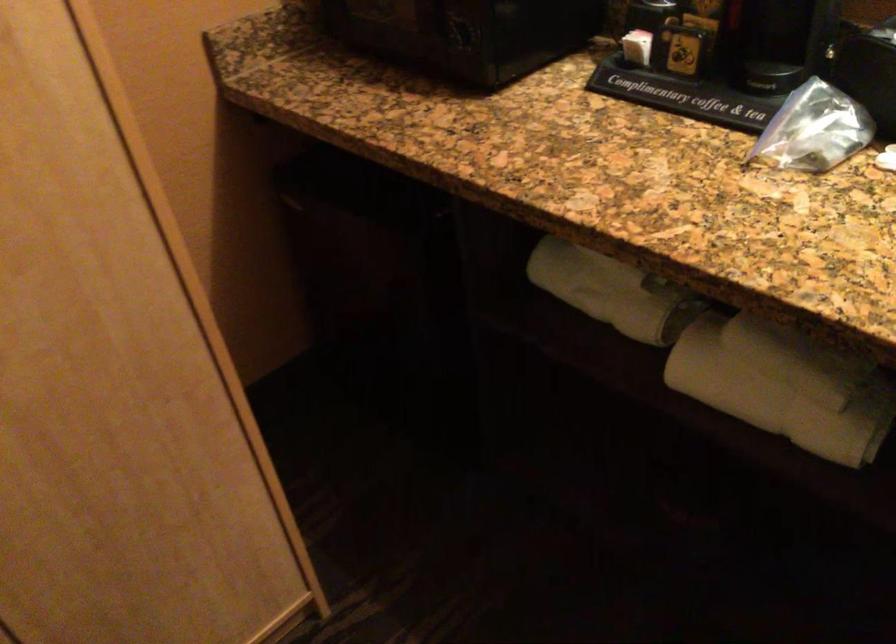
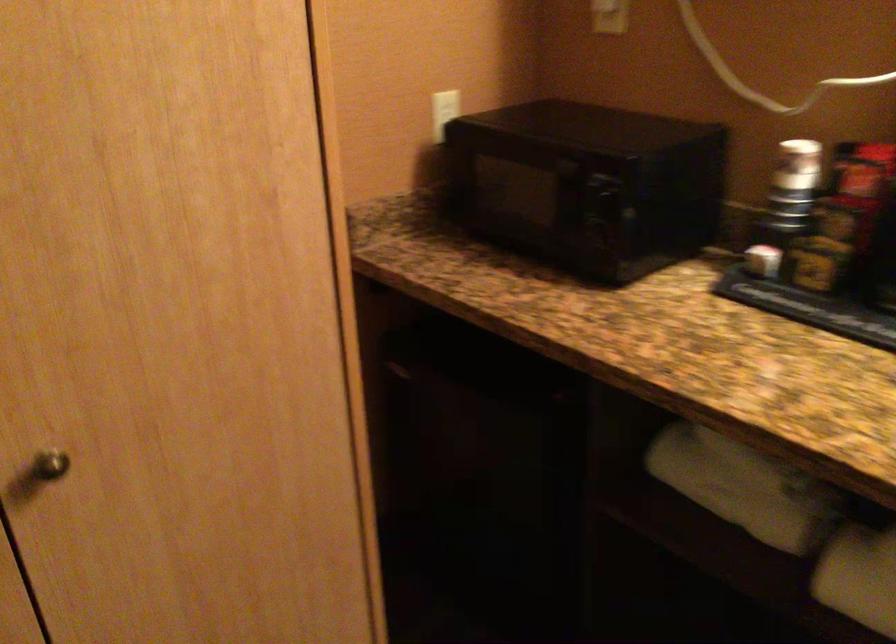
Question: The images are taken continuously from a first-person perspective. In which direction is your viewpoint rotating?

Choices:
 (A) Left
 (B) Right
 (C) Up
 (D) Down

Answer: (C)